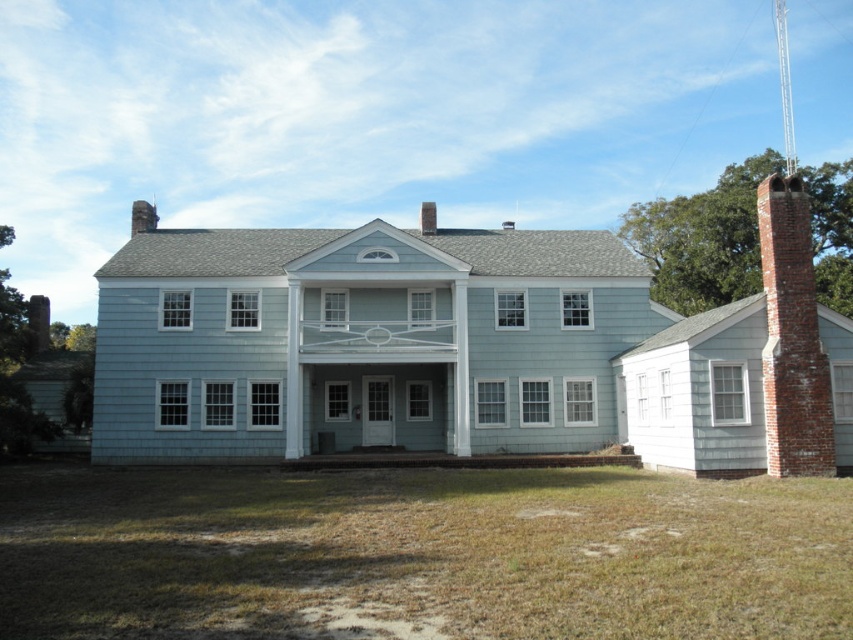
Question: Which of the following is the farthest from the observer?

Choices:
 (A) (426, 216)
 (B) (138, 228)

Answer: (B)

Question: Which of the following is the closest to the observer?

Choices:
 (A) brick chimney at upper center
 (B) brick chimney at center
 (C) brick chimney at right
 (D) brick chimney at left

Answer: (C)

Question: Does brick chimney at upper center have a smaller size compared to brick chimney at center?

Choices:
 (A) yes
 (B) no

Answer: (B)

Question: Which point appears closest to the camera in this image?

Choices:
 (A) (148, 220)
 (B) (776, 259)
 (C) (33, 298)
 (D) (421, 205)

Answer: (B)

Question: Is brick chimney at right above brick chimney at left?

Choices:
 (A) no
 (B) yes

Answer: (A)

Question: Does brick chimney at left come in front of brick chimney at upper center?

Choices:
 (A) yes
 (B) no

Answer: (B)